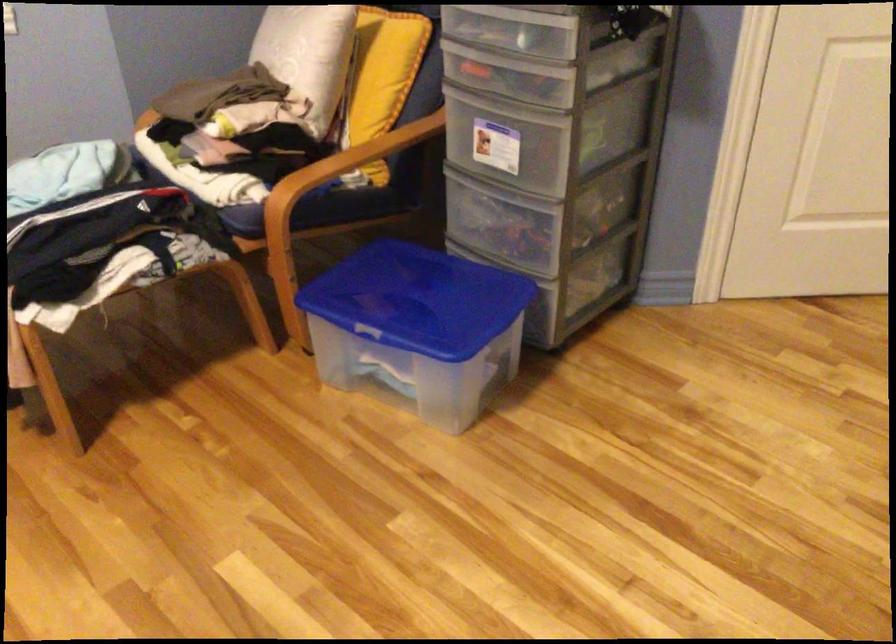
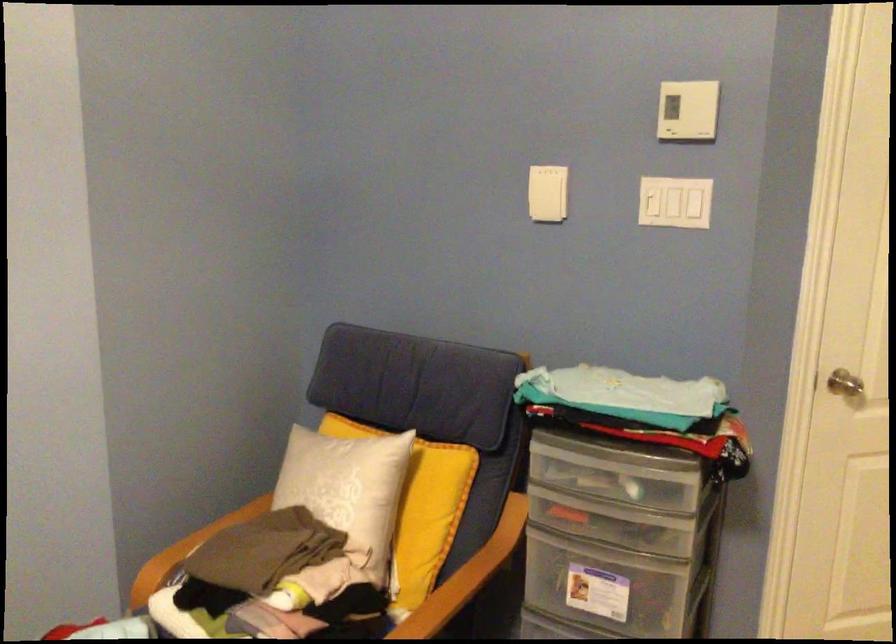
Based on the photo, the images are taken continuously from a first-person perspective. In which direction is your viewpoint rotating?

The camera's rotation is toward right-up.